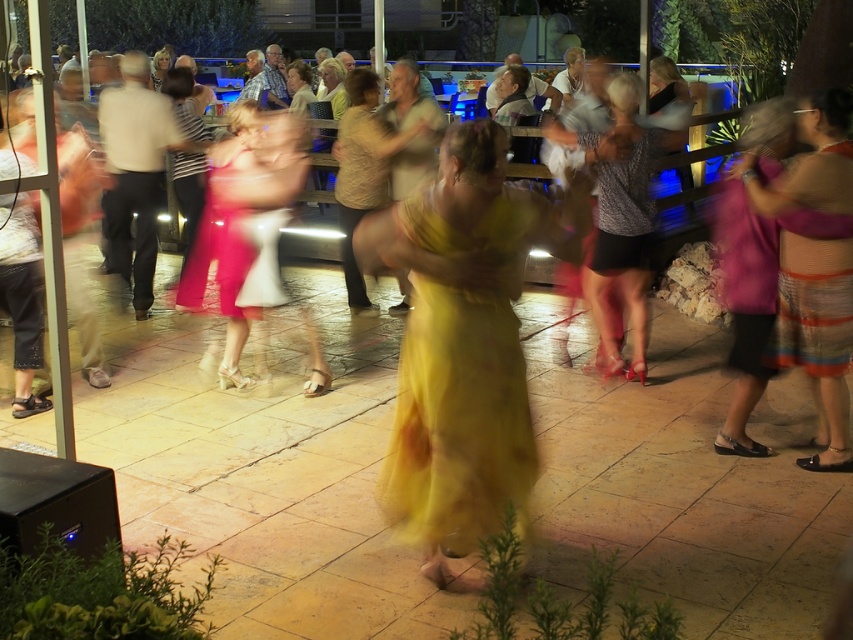
Between yellow satin dress at center and striped dress at right, which one is positioned lower?

yellow satin dress at center is below.

Is point (518, 461) closer to viewer compared to point (811, 100)?

That is True.

What are the coordinates of `yellow satin dress at center` in the screenshot? It's located at (461, 385).